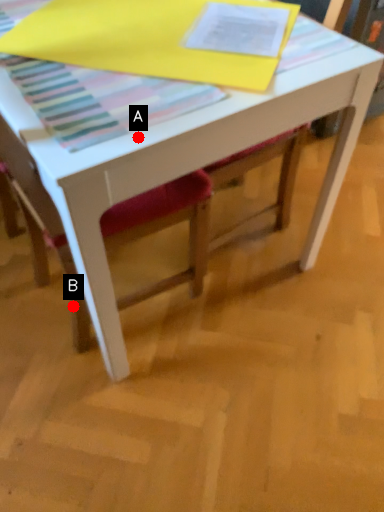
Question: Two points are circled on the image, labeled by A and B beside each circle. Which point is closer to the camera?

Choices:
 (A) A is closer
 (B) B is closer

Answer: (A)